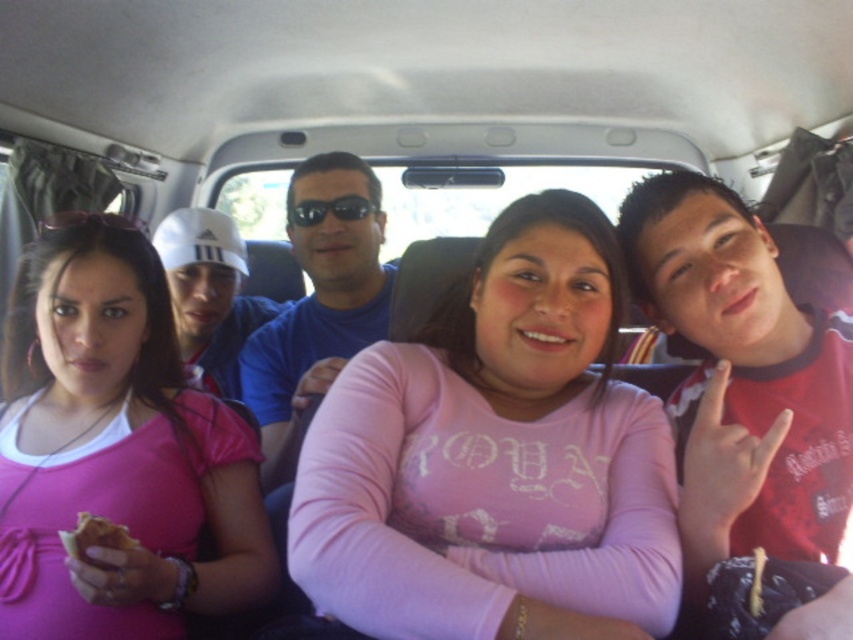
Question: Is red cotton shirt at right positioned in front of golden crispy bread at lower left?

Choices:
 (A) yes
 (B) no

Answer: (A)

Question: Which object is positioned closest to the golden crispy bread at lower left?

Choices:
 (A) pink matte shirt at center
 (B) matte white cap at left

Answer: (A)

Question: Which object is positioned closest to the blue t-shirt at center?

Choices:
 (A) matte black sunglasses at upper left
 (B) matte white cap at left

Answer: (B)

Question: From the image, what is the correct spatial relationship of pink matte shirt at center in relation to matte white cap at left?

Choices:
 (A) above
 (B) below

Answer: (B)

Question: Which object appears farthest from the camera in this image?

Choices:
 (A) matte black sunglasses at upper left
 (B) matte white cap at left

Answer: (B)

Question: From the image, what is the correct spatial relationship of pink matte shirt at center in relation to red cotton shirt at right?

Choices:
 (A) above
 (B) below

Answer: (B)